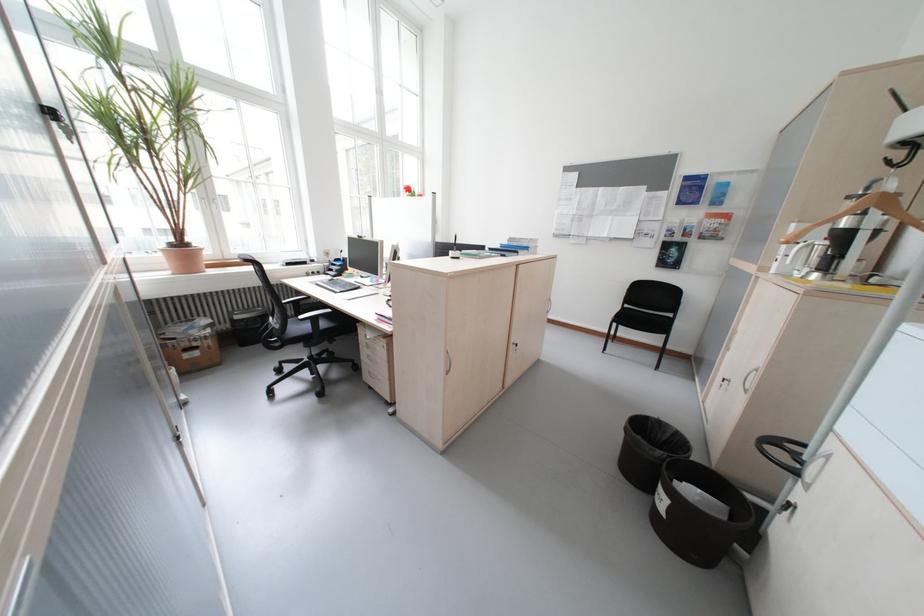
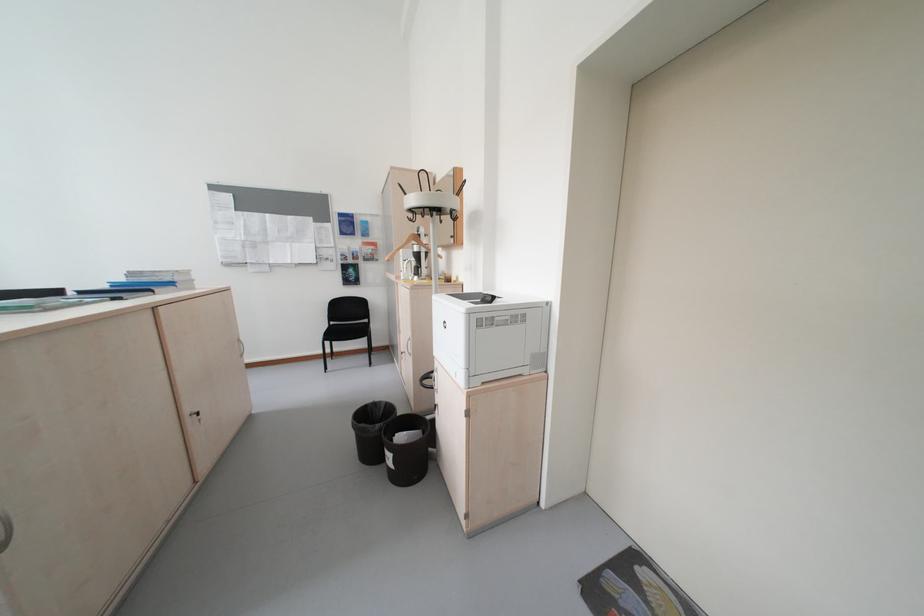
Question: The camera is either moving clockwise (left) or counter-clockwise (right) around the object. The first image is from the beginning of the video and the second image is from the end. Is the camera moving left or right when shooting the video?

Choices:
 (A) Left
 (B) Right

Answer: (A)